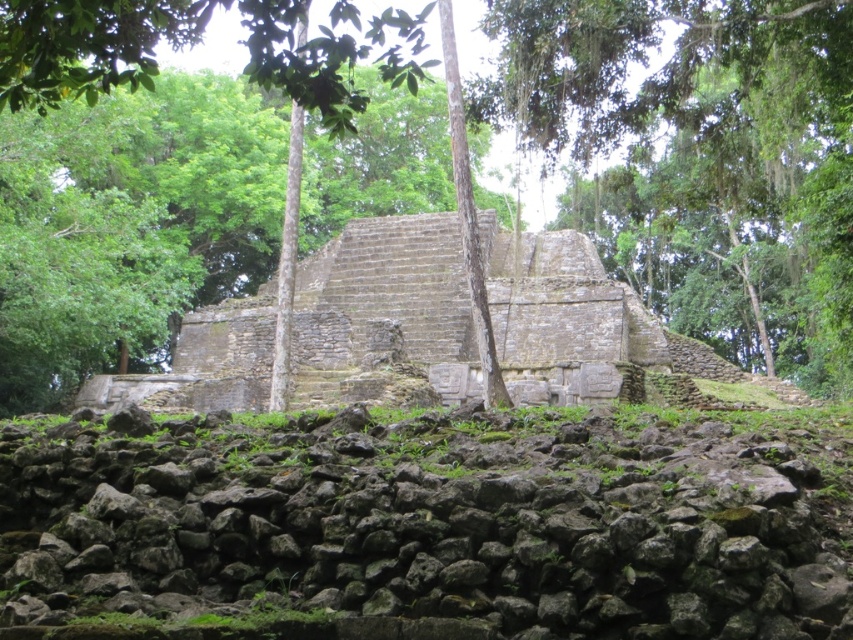
Question: Among these points, which one is nearest to the camera?

Choices:
 (A) (160, 566)
 (B) (762, 321)

Answer: (A)

Question: Which of the following is the farthest from the observer?

Choices:
 (A) green leafy tree at center
 (B) rough stone wall at center

Answer: (A)

Question: Is rough stone wall at center to the right of green leafy tree at center from the viewer's perspective?

Choices:
 (A) no
 (B) yes

Answer: (A)

Question: Which object appears farthest from the camera in this image?

Choices:
 (A) green leafy tree at center
 (B) rough stone wall at center

Answer: (A)

Question: Is rough stone wall at center to the left of green leafy tree at center from the viewer's perspective?

Choices:
 (A) no
 (B) yes

Answer: (B)

Question: Can you confirm if rough stone wall at center is positioned above green leafy tree at center?

Choices:
 (A) yes
 (B) no

Answer: (B)